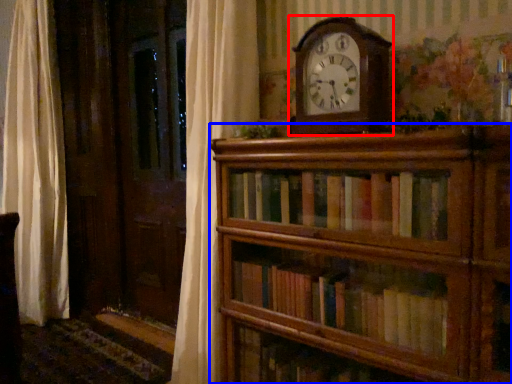
Question: Which of the following is the closest to the observer, wall clock (highlighted by a red box) or shelf (highlighted by a blue box)?

Choices:
 (A) wall clock
 (B) shelf

Answer: (B)